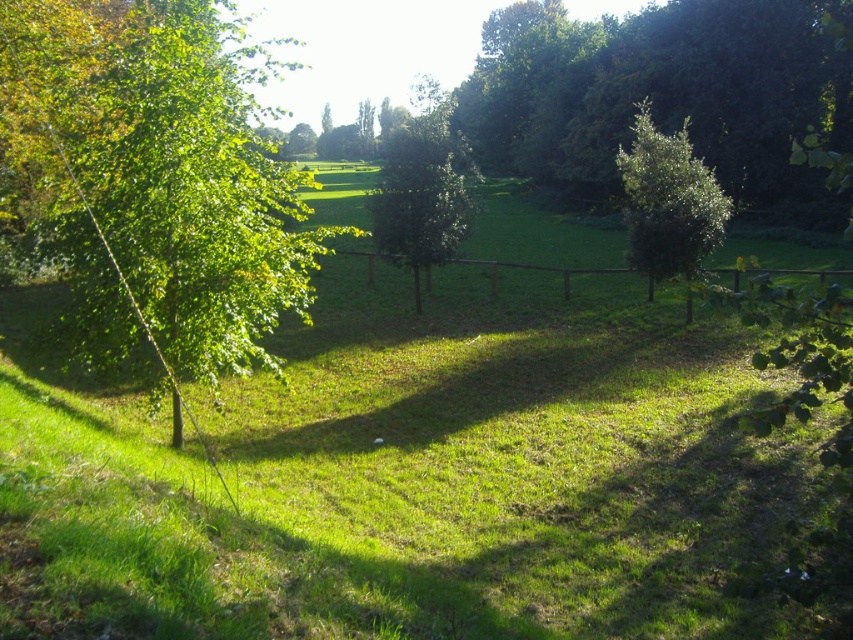
You are standing in the middle of the lawn and see the green leafy tree at right and the green leafy tree at center. Which tree is positioned to the right side of the other?

The green leafy tree at right is positioned to the right of the green leafy tree at center.

You are a gardener planning to trim the trees in the scene. Based on their thickness, which tree would require more effort to trim, the green leafy tree at right or the green leafy tree at center?

The green leafy tree at center would require more effort to trim because it is thicker than the green leafy tree at right.

Based on the photo, you are a gardener planning to plant a new tree in this area. Considering the spacing between the existing green leafy tree at left and green leafy tree at right, which tree requires more space for its width?

The green leafy tree at left requires more space for its width because its width surpasses that of the green leafy tree at right.